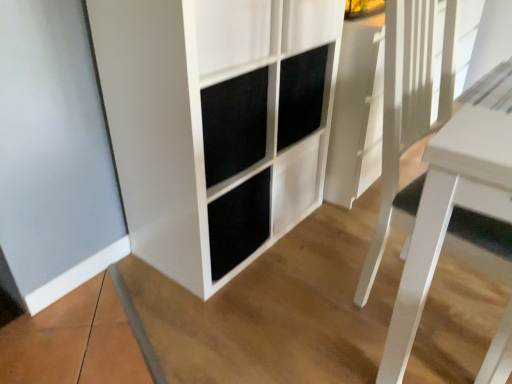
Question: From the image's perspective, does white matte cabinet at center appear higher than white glossy table at right?

Choices:
 (A) no
 (B) yes

Answer: (B)

Question: Can you confirm if white matte cabinet at center is smaller than white glossy table at right?

Choices:
 (A) no
 (B) yes

Answer: (A)

Question: Does white matte cabinet at center come behind white glossy table at right?

Choices:
 (A) no
 (B) yes

Answer: (B)

Question: Can you confirm if white matte cabinet at center is bigger than white glossy table at right?

Choices:
 (A) yes
 (B) no

Answer: (A)

Question: Is white matte cabinet at center thinner than white glossy table at right?

Choices:
 (A) yes
 (B) no

Answer: (B)

Question: Does white matte cabinet at center have a greater height compared to white glossy table at right?

Choices:
 (A) no
 (B) yes

Answer: (B)

Question: Can you confirm if white glossy table at right is thinner than white matte cabinet at center?

Choices:
 (A) yes
 (B) no

Answer: (A)

Question: Is white glossy table at right closer to camera compared to white matte cabinet at center?

Choices:
 (A) no
 (B) yes

Answer: (B)

Question: Is white matte cabinet at center surrounded by white glossy table at right?

Choices:
 (A) no
 (B) yes

Answer: (A)

Question: Would you say white glossy table at right is outside white matte cabinet at center?

Choices:
 (A) yes
 (B) no

Answer: (A)

Question: From a real-world perspective, is white glossy table at right positioned under white matte cabinet at center based on gravity?

Choices:
 (A) no
 (B) yes

Answer: (B)

Question: Is white glossy table at right behind white matte cabinet at center?

Choices:
 (A) no
 (B) yes

Answer: (A)

Question: Looking at their shapes, would you say white glossy table at right is wider or thinner than white matte cabinet at center?

Choices:
 (A) wide
 (B) thin

Answer: (B)